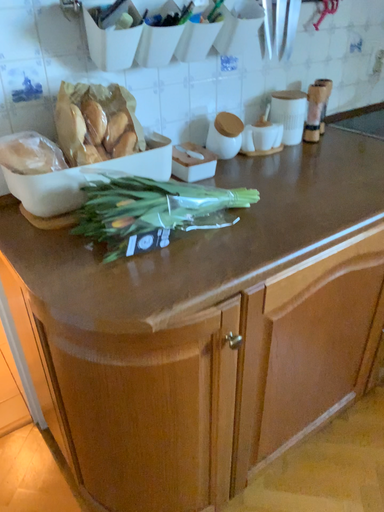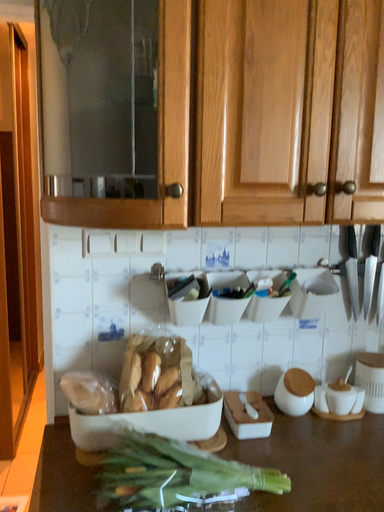
Question: How did the camera likely rotate when shooting the video?

Choices:
 (A) rotated upward
 (B) rotated downward

Answer: (A)